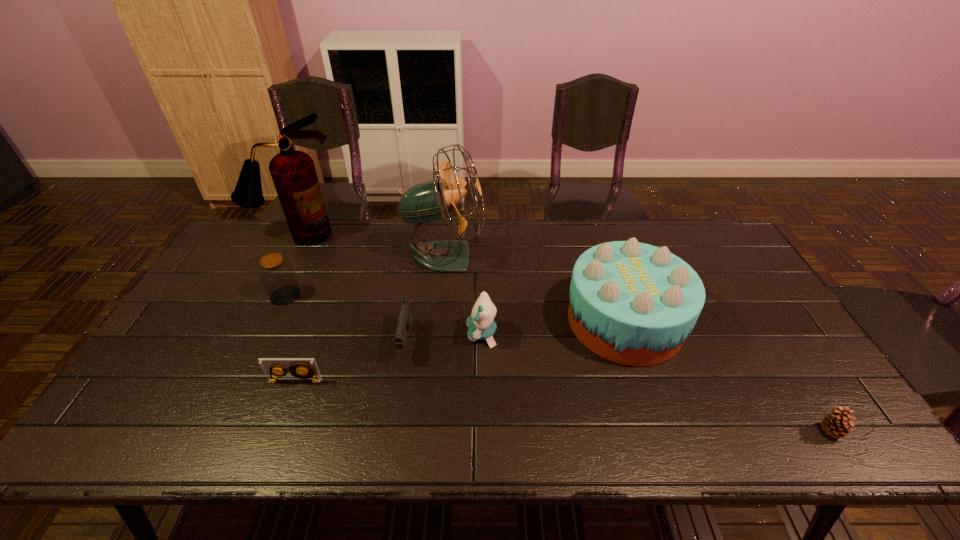
The height and width of the screenshot is (540, 960). I want to click on fire extinguisher, so click(293, 172).

Where is `fan`? fan is located at coordinates (428, 201).

In order to click on the seventh object from left to right in this screenshot , I will do `click(632, 303)`.

Locate an element on the screen. Image resolution: width=960 pixels, height=540 pixels. the third tallest object is located at coordinates (632, 303).

Locate an element on the screen. jar is located at coordinates (277, 276).

Locate an element on the screen. kitten is located at coordinates (481, 325).

The width and height of the screenshot is (960, 540). Identify the location of pistol. (405, 318).

Image resolution: width=960 pixels, height=540 pixels. Find the location of `the seventh farthest object`. the seventh farthest object is located at coordinates (x=301, y=369).

This screenshot has height=540, width=960. I want to click on pinecone, so click(x=837, y=423).

At what (x,y) coordinates should I click in order to perform the action: click on the nearest object. Please return your answer as a coordinate pair (x, y). Looking at the image, I should click on (837, 423).